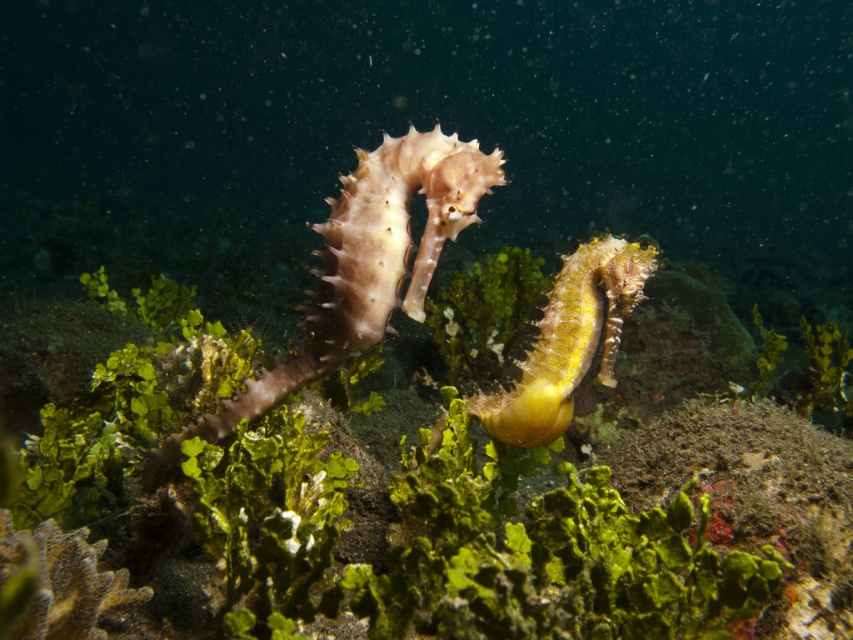
Can you confirm if smooth pink seahorse at center is positioned to the left of yellow matte seahorse at center?

Indeed, smooth pink seahorse at center is positioned on the left side of yellow matte seahorse at center.

Is smooth pink seahorse at center smaller than yellow matte seahorse at center?

Incorrect, smooth pink seahorse at center is not smaller in size than yellow matte seahorse at center.

Image resolution: width=853 pixels, height=640 pixels. In order to click on smooth pink seahorse at center in this screenshot , I will do `click(361, 268)`.

Where is `smooth pink seahorse at center`? This screenshot has height=640, width=853. smooth pink seahorse at center is located at coordinates (361, 268).

Does green mossy coral at center appear on the right side of smooth pink seahorse at center?

Incorrect, green mossy coral at center is not on the right side of smooth pink seahorse at center.

Looking at this image, between green mossy coral at center and smooth pink seahorse at center, which one has less height?

green mossy coral at center is shorter.

Find the location of a particular element. green mossy coral at center is located at coordinates (456, 541).

Is green mossy coral at center shorter than yellow matte seahorse at center?

Incorrect, green mossy coral at center's height does not fall short of yellow matte seahorse at center's.

Can you confirm if green mossy coral at center is positioned above yellow matte seahorse at center?

Actually, green mossy coral at center is below yellow matte seahorse at center.

Who is more forward, (231,628) or (587,308)?

Positioned in front is point (231,628).

You are a GUI agent. You are given a task and a screenshot of the screen. Output one action in this format:
    pyautogui.click(x=<x>, y=<y>)
    Task: Click on the green mossy coral at center
    
    Given the screenshot: What is the action you would take?
    pyautogui.click(x=456, y=541)